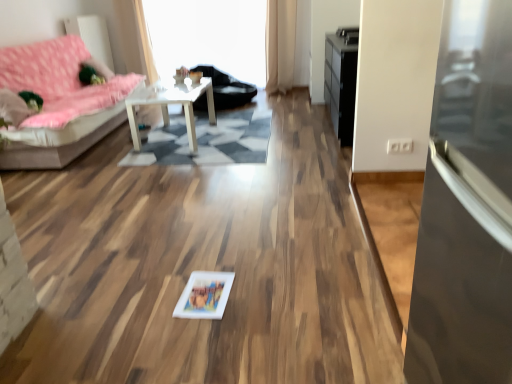
This screenshot has height=384, width=512. I want to click on vacant space underneath white glossy picture frame at center (from a real-world perspective), so click(x=205, y=294).